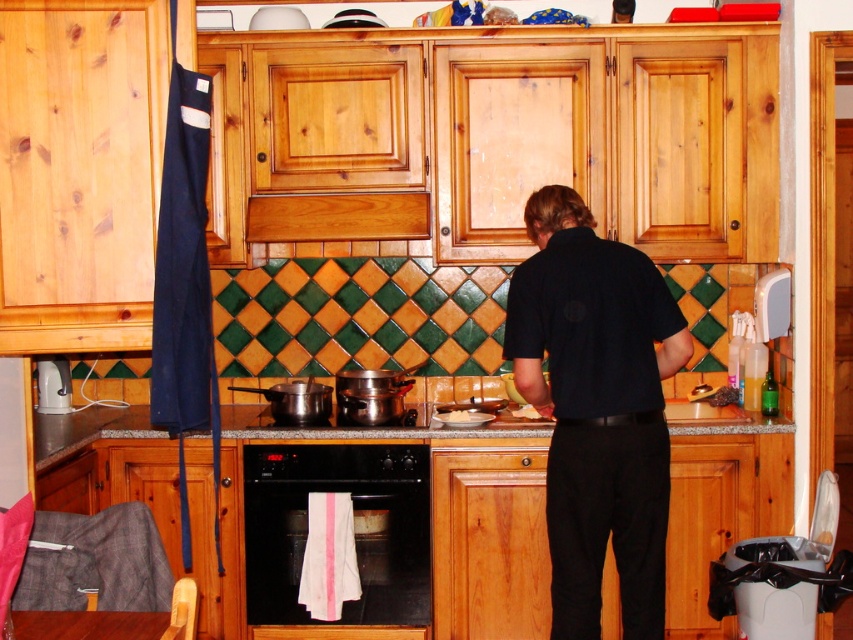
Does black matte oven at center appear on the right side of white plastic kettle at left?

Yes, black matte oven at center is to the right of white plastic kettle at left.

Is black matte oven at center thinner than white plastic kettle at left?

Incorrect, black matte oven at center's width is not less than white plastic kettle at left's.

What do you see at coordinates (354, 531) in the screenshot? This screenshot has width=853, height=640. I see `black matte oven at center` at bounding box center [354, 531].

Where is `black matte oven at center`? Image resolution: width=853 pixels, height=640 pixels. black matte oven at center is located at coordinates (354, 531).

Does black matte shirt at center lie in front of white plastic kettle at left?

Yes, it is in front of white plastic kettle at left.

Is black matte shirt at center to the right of white plastic kettle at left from the viewer's perspective?

Indeed, black matte shirt at center is positioned on the right side of white plastic kettle at left.

This screenshot has height=640, width=853. In order to click on black matte shirt at center in this screenshot , I will do `click(596, 408)`.

Does granite gray counter top at center appear under white plastic kettle at left?

Indeed, granite gray counter top at center is positioned under white plastic kettle at left.

Who is higher up, granite gray counter top at center or white plastic kettle at left?

Positioned higher is white plastic kettle at left.

The width and height of the screenshot is (853, 640). What do you see at coordinates (367, 428) in the screenshot?
I see `granite gray counter top at center` at bounding box center [367, 428].

This screenshot has height=640, width=853. Identify the location of granite gray counter top at center. (367, 428).